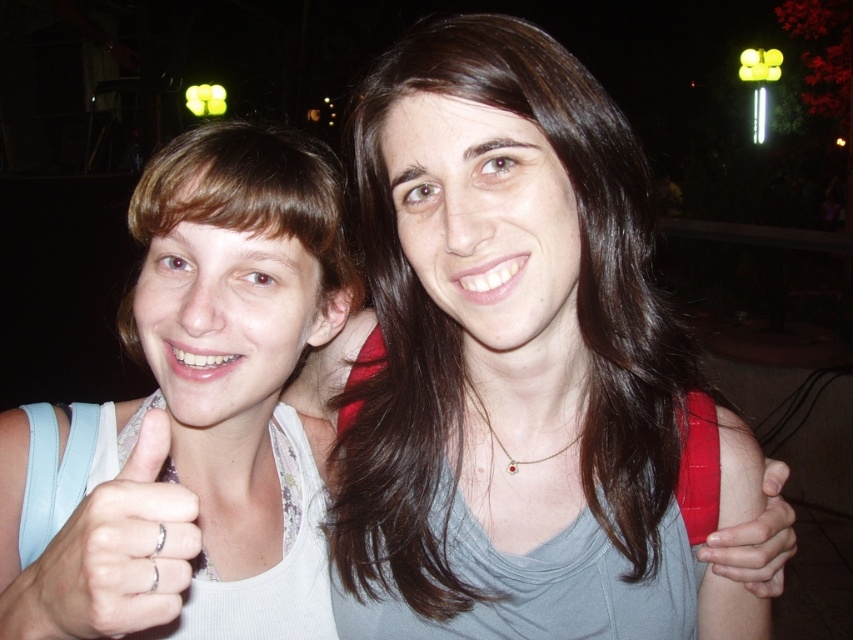
You are a photographer trying to focus on the silver metallic ring at lower left and the smooth skin hand at center in this nighttime photo. Which object should you adjust your camera focus on first to ensure it appears sharp in the final image?

The silver metallic ring at lower left is closer to the viewer than the smooth skin hand at center, so you should focus on the silver metallic ring at lower left first to ensure it appears sharp in the final image.

You are taking a photo of two friends at night. You want to ensure that the focus is on the point at coordinates point (122, 403). If your camera has a depth of field that can clearly capture objects within 25 inches of the focal point, will the two friends be in focus?

The distance of point (122, 403) from camera is 28.78 inches. Since the depth of field can only capture objects within 25 inches of the focal point, the two friends will be slightly out of focus.

You are a photographer trying to adjust the focus of your camera. You want to ensure both the white fabric shirt at left and the silver metallic ring at lower left are in focus. Which object should you focus on first to achieve this?

You should focus on the white fabric shirt at left first because it is taller than the silver metallic ring at lower left, so focusing on the farther object first will increase the chances of both being in focus.